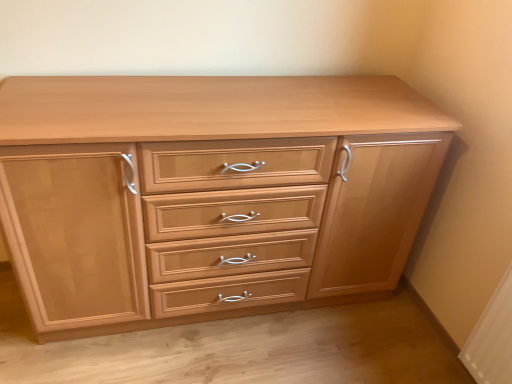
What are the coordinates of `free space above light wood chest of drawers at center (from a real-world perspective)` in the screenshot? It's located at (168, 100).